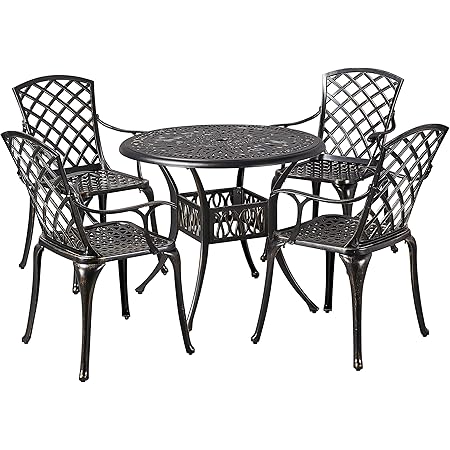
The width and height of the screenshot is (450, 450). In order to click on front left chair in this screenshot , I will do `click(111, 240)`.